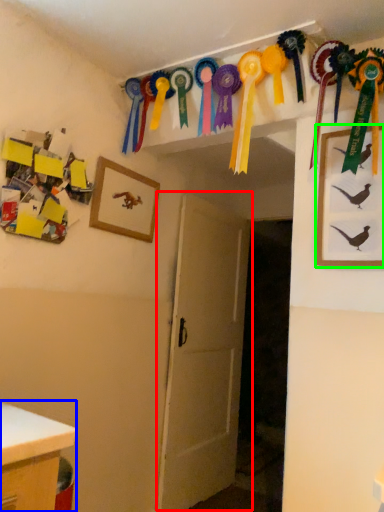
Question: Based on their relative distances, which object is farther from door (highlighted by a red box)? Choose from desk (highlighted by a blue box) and picture frame (highlighted by a green box).

Choices:
 (A) desk
 (B) picture frame

Answer: (A)